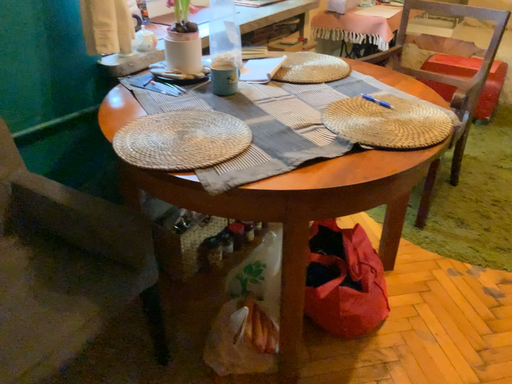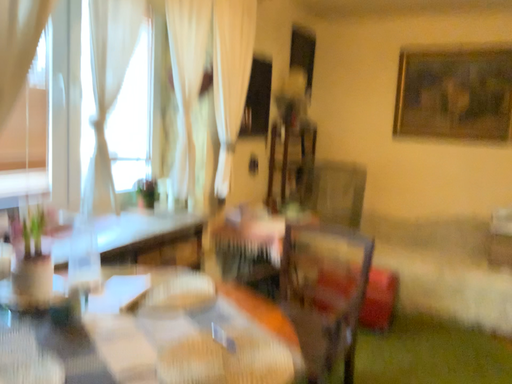
Question: How did the camera likely rotate when shooting the video?

Choices:
 (A) rotated upward
 (B) rotated downward

Answer: (A)